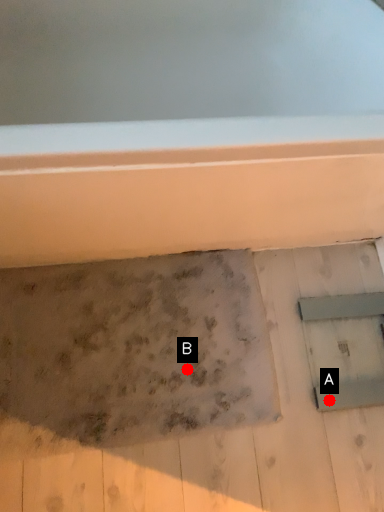
Question: Two points are circled on the image, labeled by A and B beside each circle. Which of the following is the closest to the observer?

Choices:
 (A) A is closer
 (B) B is closer

Answer: (A)